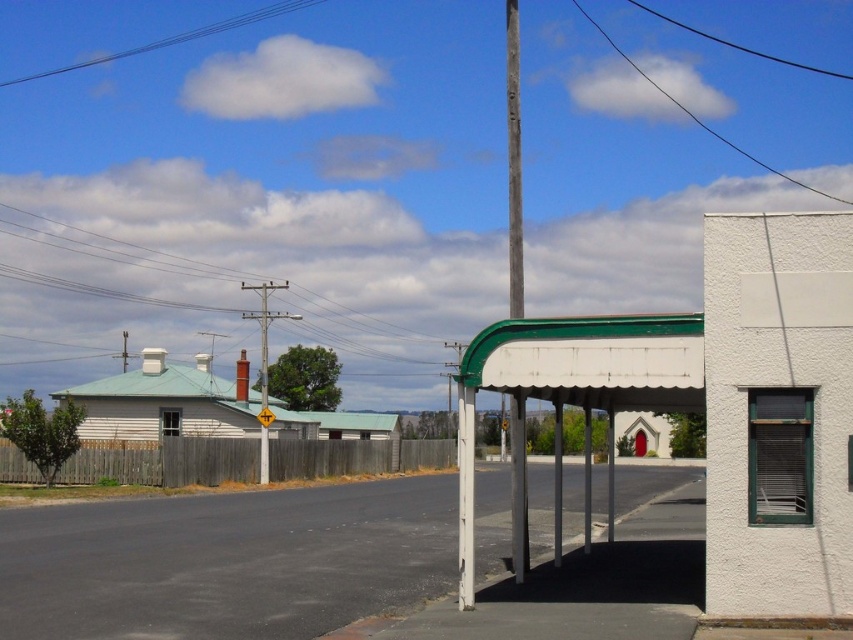
You are standing at the edge of the white matte canopy at center and looking towards the black wire at upper center. Which object is higher in your field of view?

The black wire at upper center is higher in your field of view since the white matte canopy at center is below it.

In the scene shown: You are a pedestrian waiting at the white metal bus stop at center. You notice clear blue wires at upper center. In which direction relative to the bus stop are the clear blue wires located?

The clear blue wires at upper center are located to the left of the white metal bus stop at center.

You are a delivery person trying to locate the address on the yellow plastic sign at center. You notice clear blue wires at upper center nearby. Which object is bigger in size?

The clear blue wires at upper center is larger in size than the yellow plastic sign at center.